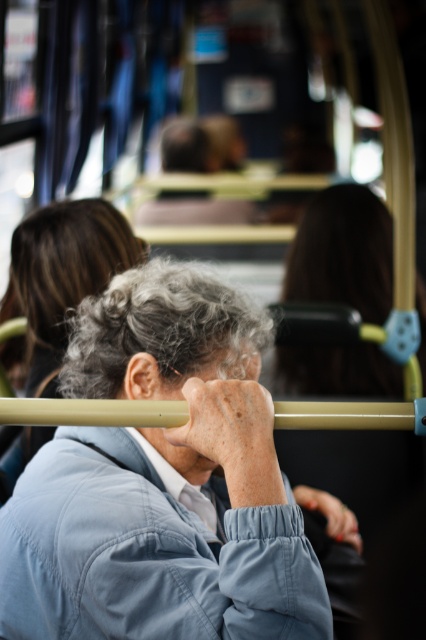
Based on the photo, you are a passenger on a bus and want to reach the yellow handrail with blue plastic grip near the elderly person in the light blue fabric jacket at center. Considering the distance between you and the jacket, can you estimate if you can comfortably reach the handrail without moving your position?

The light blue fabric jacket at center is 3.84 feet away from the viewer. Since the jacket is part of the elderly person holding the handrail, this distance suggests the handrail is also approximately 3.84 feet away. A typical person can comfortably reach about 3 feet, so you may need to extend your arm slightly but should still be able to reach the handrail without moving.

You are a passenger on a bus and need to reach the light blue fabric jacket at center. The bus is moving, so you must move carefully. Which direction should you move from your current position at point (161, 483) to safely grab the jacket?

The light blue fabric jacket at center is located exactly at your current position at point (161, 483), so you don not need to move any direction to reach it.

You are a passenger on a bus and notice two items in the scene. The first is the light blue fabric jacket at center, and the second is the dark brown hair at upper center. Which of these is positioned higher up in the image?

The dark brown hair at upper center is positioned higher up in the image than the light blue fabric jacket at center.